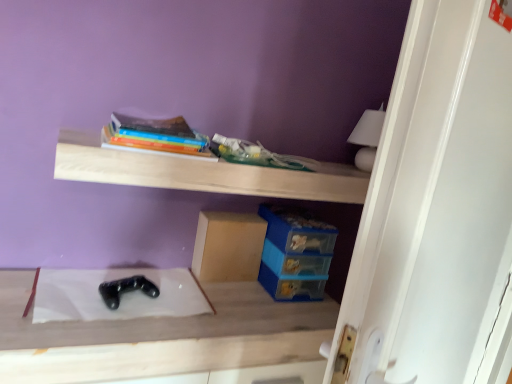
Identify the location of free space in front of black matte game controller at lower center. The width and height of the screenshot is (512, 384). (101, 330).